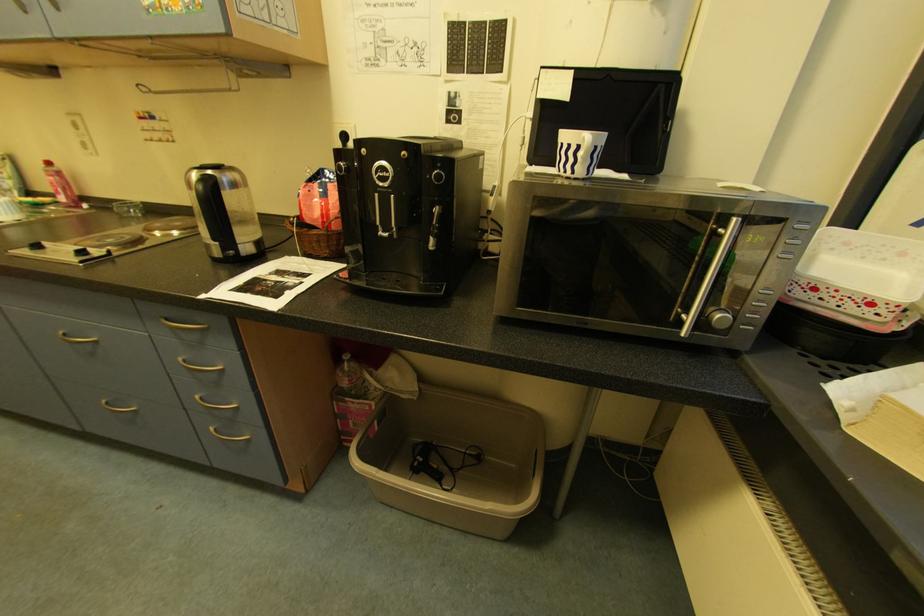
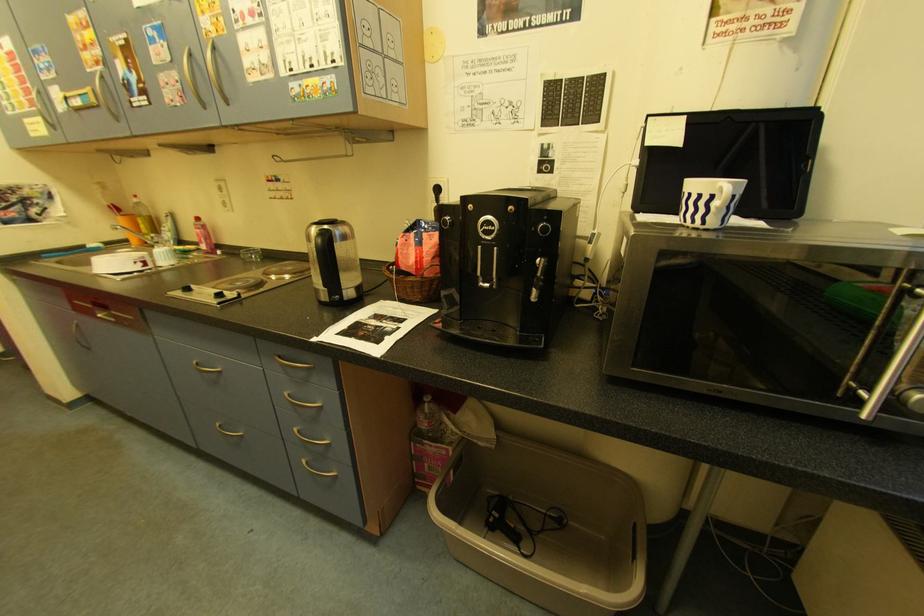
Question: The camera is either moving clockwise (left) or counter-clockwise (right) around the object. The first image is from the beginning of the video and the second image is from the end. Is the camera moving left or right when shooting the video?

Choices:
 (A) Left
 (B) Right

Answer: (B)